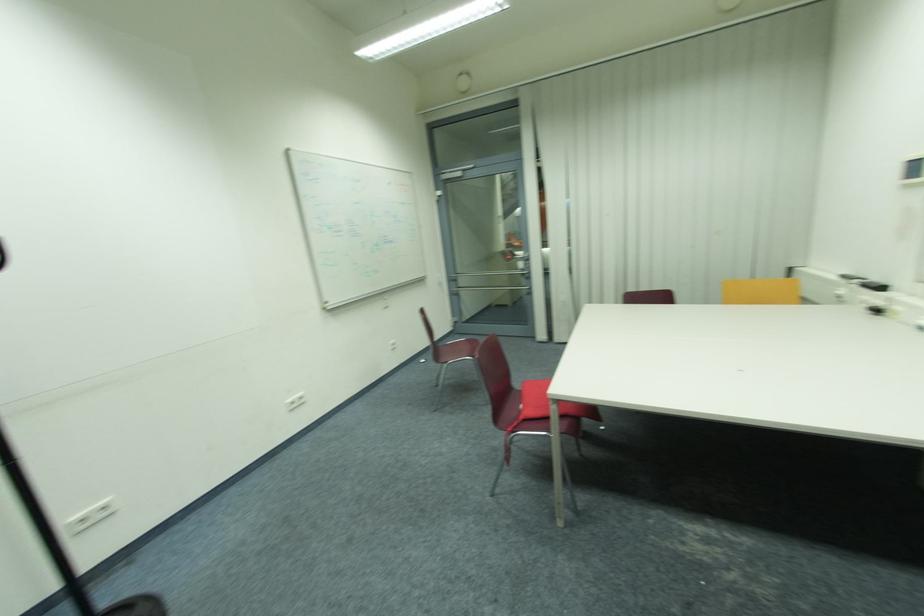
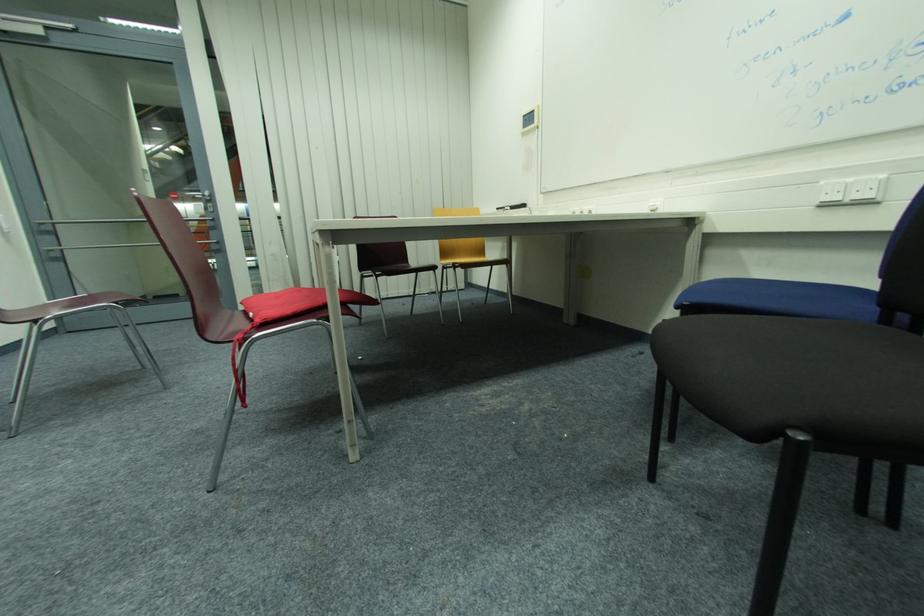
Question: Based on the continuous images, in which direction is the camera rotating? Reply with the corresponding letter.

Choices:
 (A) Left
 (B) Right
 (C) Up
 (D) Down

Answer: (B)